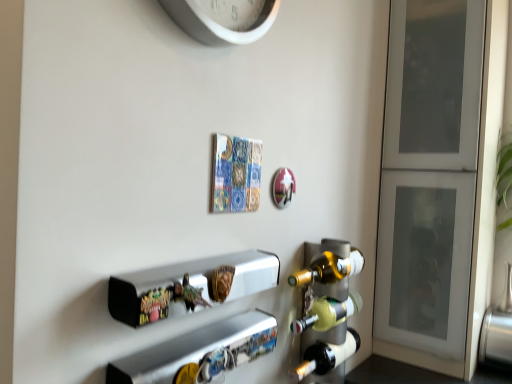
How much space does metallic silver shelf at lower center, which ranks as the second shelf in top-to-bottom order, occupy horizontally?

metallic silver shelf at lower center, which ranks as the second shelf in top-to-bottom order, is 3.19 inches wide.

Find the location of a particular element. white frosted glass cabinet at right is located at coordinates (435, 186).

Find the location of a particular element. metallic silver shelf at center, the second shelf from the bottom is located at coordinates (189, 286).

Describe the element at coordinates (326, 356) in the screenshot. I see `translucent glass beer bottle at lower right` at that location.

Where is `metallic silver shelf at lower center, acting as the 1th shelf starting from the bottom`? metallic silver shelf at lower center, acting as the 1th shelf starting from the bottom is located at coordinates (200, 352).

Is translucent glass beer bottle at lower right thinner than matte glass wine rack at right?

In fact, translucent glass beer bottle at lower right might be wider than matte glass wine rack at right.

In the scene shown: Considering the relative sizes of translucent glass beer bottle at lower right and matte glass wine rack at right in the image provided, is translucent glass beer bottle at lower right taller than matte glass wine rack at right?

No.

Does translucent glass beer bottle at lower right appear on the left side of matte glass wine rack at right?

Correct, you'll find translucent glass beer bottle at lower right to the left of matte glass wine rack at right.

Identify the location of wine rack above the translucent glass beer bottle at lower right (from a real-world perspective). (327, 309).

Is matte glass wine rack at right further to the viewer compared to translucent glass beer bottle at lower right?

That is True.

Can you see matte glass wine rack at right touching translucent glass beer bottle at lower right?

Yes, matte glass wine rack at right is touching translucent glass beer bottle at lower right.

How many degrees apart are the facing directions of matte glass wine rack at right and translucent glass beer bottle at lower right?

The angle between the facing direction of matte glass wine rack at right and the facing direction of translucent glass beer bottle at lower right is 0.264 degrees.

Can you confirm if matte glass wine rack at right is wider than translucent glass beer bottle at lower right?

In fact, matte glass wine rack at right might be narrower than translucent glass beer bottle at lower right.

Is point (184, 6) farther from camera compared to point (409, 3)?

No, (184, 6) is in front of (409, 3).

Looking at this image, considering the positions of objects white plastic clock at upper center and white frosted glass cabinet at right in the image provided, who is in front, white plastic clock at upper center or white frosted glass cabinet at right?

white plastic clock at upper center is closer to the camera.

Considering the relative sizes of white plastic clock at upper center and white frosted glass cabinet at right in the image provided, is white plastic clock at upper center smaller than white frosted glass cabinet at right?

Yes.

Does point (313, 347) lie in front of point (175, 276)?

No, (313, 347) is further to viewer.

Is translucent glass beer bottle at lower right wider than metallic silver shelf at center, the first shelf viewed from the top?

Yes.

Between translucent glass beer bottle at lower right and metallic silver shelf at center, the second shelf from the bottom, which one has less height?

metallic silver shelf at center, the second shelf from the bottom.

Measure the distance from translucent glass beer bottle at lower right to metallic silver shelf at center, the first shelf viewed from the top.

translucent glass beer bottle at lower right is 14.84 inches from metallic silver shelf at center, the first shelf viewed from the top.

Is metallic silver shelf at center, the first shelf viewed from the top, bigger or smaller than white plastic clock at upper center?

Clearly, metallic silver shelf at center, the first shelf viewed from the top, is smaller in size than white plastic clock at upper center.

Is the surface of metallic silver shelf at center, the second shelf from the bottom, in direct contact with white plastic clock at upper center?

No, metallic silver shelf at center, the second shelf from the bottom, is not making contact with white plastic clock at upper center.

Does metallic silver shelf at center, the first shelf viewed from the top, come behind white plastic clock at upper center?

No.

Is metallic silver shelf at center, the second shelf from the bottom, thinner than white plastic clock at upper center?

Incorrect, the width of metallic silver shelf at center, the second shelf from the bottom, is not less than that of white plastic clock at upper center.

Considering the relative sizes of white plastic clock at upper center and matte glass wine rack at right in the image provided, is white plastic clock at upper center shorter than matte glass wine rack at right?

Yes, white plastic clock at upper center is shorter than matte glass wine rack at right.

Which of these two, white plastic clock at upper center or matte glass wine rack at right, is bigger?

With larger size is white plastic clock at upper center.

In the scene shown: Is white plastic clock at upper center wider or thinner than matte glass wine rack at right?

Clearly, white plastic clock at upper center has less width compared to matte glass wine rack at right.

From the image's perspective, between white plastic clock at upper center and matte glass wine rack at right, who is located below?

From the image's view, matte glass wine rack at right is below.

Between metallic silver shelf at center, the second shelf from the bottom, and white frosted glass cabinet at right, which one has larger size?

white frosted glass cabinet at right is bigger.

Identify the location of the 2nd shelf in front of the white frosted glass cabinet at right. This screenshot has height=384, width=512. (189, 286).

Can you confirm if metallic silver shelf at center, the second shelf from the bottom, is thinner than white frosted glass cabinet at right?

Correct, the width of metallic silver shelf at center, the second shelf from the bottom, is less than that of white frosted glass cabinet at right.

From the image's perspective, is metallic silver shelf at center, the first shelf viewed from the top, positioned above or below white frosted glass cabinet at right?

metallic silver shelf at center, the first shelf viewed from the top, is situated lower than white frosted glass cabinet at right in the image.

Find the location of `wine rack on the right of translucent glass beer bottle at lower right`. wine rack on the right of translucent glass beer bottle at lower right is located at coordinates (327, 309).

Locate an element on the screen. beer bottle that appears below the matte glass wine rack at right (from a real-world perspective) is located at coordinates (326, 356).

Considering their positions, is matte glass wine rack at right positioned closer to metallic silver shelf at center, the second shelf from the bottom, than metallic silver shelf at lower center, which ranks as the second shelf in top-to-bottom order?

metallic silver shelf at lower center, which ranks as the second shelf in top-to-bottom order.

Looking at the image, which one is located further to metallic silver shelf at center, the second shelf from the bottom, white frosted glass cabinet at right or matte glass wine rack at right?

Among the two, white frosted glass cabinet at right is located further to metallic silver shelf at center, the second shelf from the bottom.

Considering their positions, is metallic silver shelf at center, the second shelf from the bottom, positioned further to white plastic clock at upper center than translucent glass beer bottle at lower right?

Among the two, translucent glass beer bottle at lower right is located further to white plastic clock at upper center.

Estimate the real-world distances between objects in this image. Which object is closer to matte glass wine rack at right, white frosted glass cabinet at right or translucent glass beer bottle at lower right?

Among the two, translucent glass beer bottle at lower right is located nearer to matte glass wine rack at right.

Estimate the real-world distances between objects in this image. Which object is closer to white plastic clock at upper center, metallic silver shelf at center, the second shelf from the bottom, or matte glass wine rack at right?

Based on the image, metallic silver shelf at center, the second shelf from the bottom, appears to be nearer to white plastic clock at upper center.

From the image, which object appears to be nearer to matte glass wine rack at right, white frosted glass cabinet at right or metallic silver shelf at center, the second shelf from the bottom?

metallic silver shelf at center, the second shelf from the bottom.

Estimate the real-world distances between objects in this image. Which object is further from white plastic clock at upper center, metallic silver shelf at lower center, acting as the 1th shelf starting from the bottom, or translucent glass beer bottle at lower right?

translucent glass beer bottle at lower right is further to white plastic clock at upper center.

Estimate the real-world distances between objects in this image. Which object is closer to white frosted glass cabinet at right, translucent glass beer bottle at lower right or white plastic clock at upper center?

translucent glass beer bottle at lower right.

This screenshot has height=384, width=512. I want to click on wine rack between white plastic clock at upper center and translucent glass beer bottle at lower right in the up-down direction, so click(x=327, y=309).

What are the coordinates of `beer bottle between metallic silver shelf at lower center, acting as the 1th shelf starting from the bottom, and matte glass wine rack at right, along the z-axis` in the screenshot? It's located at (326, 356).

The width and height of the screenshot is (512, 384). I want to click on shelf between metallic silver shelf at lower center, acting as the 1th shelf starting from the bottom, and white frosted glass cabinet at right, in the horizontal direction, so click(x=189, y=286).

Where is `shelf positioned between metallic silver shelf at center, the second shelf from the bottom, and matte glass wine rack at right from near to far`? The width and height of the screenshot is (512, 384). shelf positioned between metallic silver shelf at center, the second shelf from the bottom, and matte glass wine rack at right from near to far is located at coordinates (200, 352).